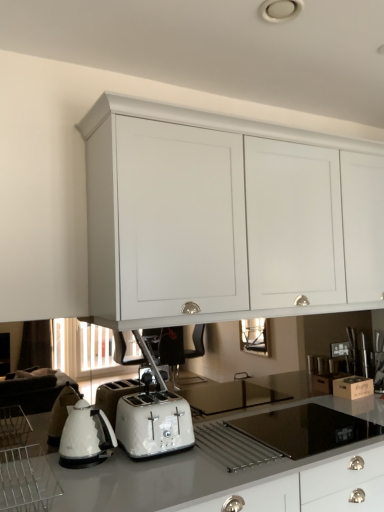
At what (x,y) coordinates should I click in order to perform the action: click on vacant area in front of white glossy toaster at lower center. Please return your answer as a coordinate pair (x, y). The width and height of the screenshot is (384, 512). Looking at the image, I should click on (147, 475).